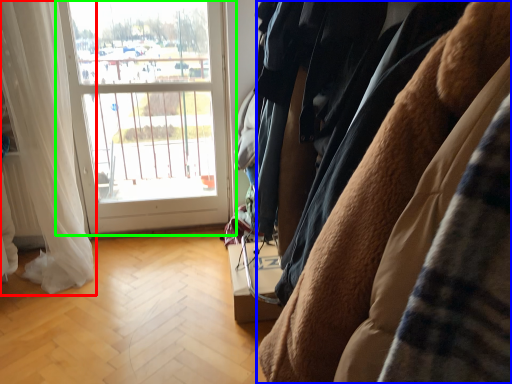
Question: Considering the real-world distances, which object is farthest from curtain (highlighted by a red box)? furniture (highlighted by a blue box) or window (highlighted by a green box)?

Choices:
 (A) furniture
 (B) window

Answer: (A)